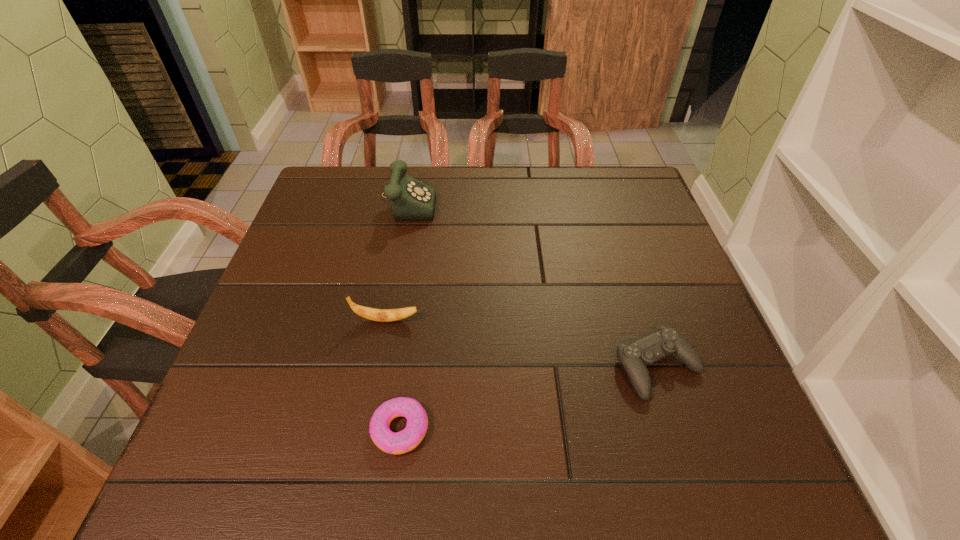
You are a GUI agent. You are given a task and a screenshot of the screen. Output one action in this format:
    pyautogui.click(x=<x>, y=<y>)
    Task: Click on the tallest object
    The image size is (960, 540).
    Given the screenshot: What is the action you would take?
    pyautogui.click(x=411, y=199)

At what (x,y) coordinates should I click in order to perform the action: click on the farthest object. Please return your answer as a coordinate pair (x, y). This screenshot has width=960, height=540. Looking at the image, I should click on (411, 199).

Find the location of a particular element. the third shortest object is located at coordinates (381, 315).

Locate an element on the screen. the second farthest object is located at coordinates (381, 315).

Find the location of `the rightmost object`. the rightmost object is located at coordinates (634, 357).

Locate an element on the screen. The image size is (960, 540). the third tallest object is located at coordinates (634, 357).

The height and width of the screenshot is (540, 960). Identify the location of doughnut. click(410, 437).

The image size is (960, 540). What are the coordinates of `the shortest object` in the screenshot? It's located at (410, 437).

Where is `vacant area situated 0.260m on the dial of the telephone`? The width and height of the screenshot is (960, 540). vacant area situated 0.260m on the dial of the telephone is located at coordinates (530, 200).

This screenshot has height=540, width=960. In order to click on vacant space located 0.120m on the peel of the banana from the top in this screenshot , I will do `click(477, 320)`.